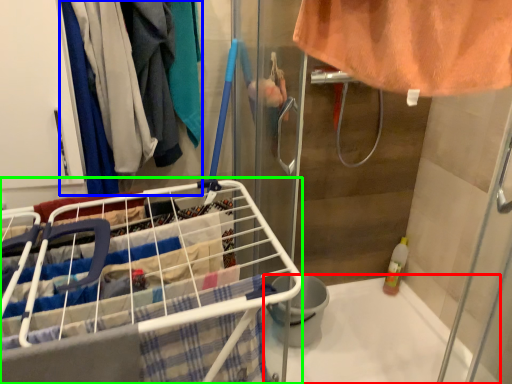
Question: Considering the real-world distances, which object is closest to bath (highlighted by a red box)? clothing (highlighted by a blue box) or shopping cart (highlighted by a green box).

Choices:
 (A) clothing
 (B) shopping cart

Answer: (B)